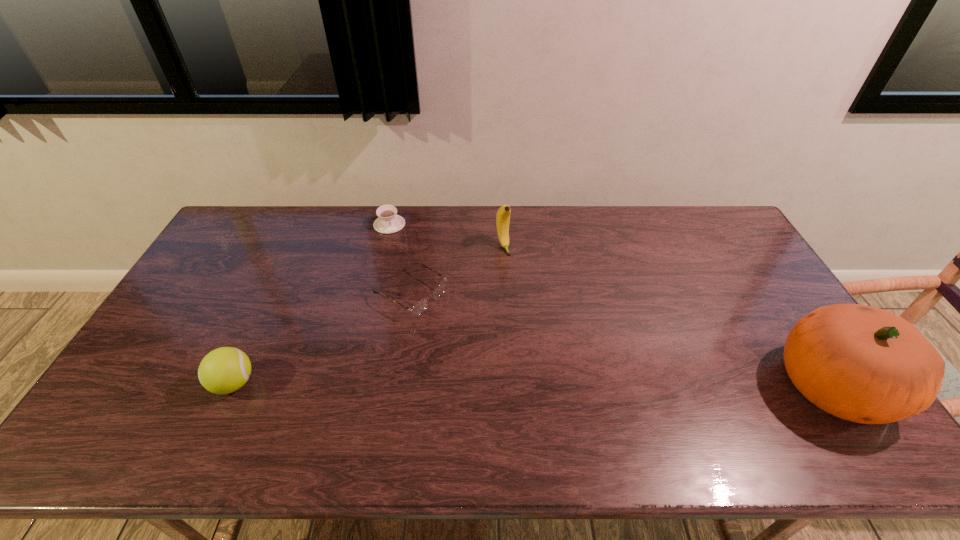
At what (x,y) coordinates should I click in order to perform the action: click on tennis ball present at the near edge. Please return your answer as a coordinate pair (x, y). Image resolution: width=960 pixels, height=540 pixels. Looking at the image, I should click on (224, 370).

This screenshot has height=540, width=960. Identify the location of pumpkin situated at the near edge. (860, 363).

Where is `object positioned at the right edge`? The height and width of the screenshot is (540, 960). object positioned at the right edge is located at coordinates (860, 363).

Find the location of `object present at the near right corner`. object present at the near right corner is located at coordinates (860, 363).

The height and width of the screenshot is (540, 960). Identify the location of vacant space at the far edge of the desktop. (642, 238).

At what (x,y) coordinates should I click in order to perform the action: click on free spot at the near edge of the desktop. Please return your answer as a coordinate pair (x, y). The width and height of the screenshot is (960, 540). Looking at the image, I should click on point(492,403).

Find the location of a particular element. This screenshot has width=960, height=540. blank space at the left edge of the desktop is located at coordinates (251, 256).

You are a GUI agent. You are given a task and a screenshot of the screen. Output one action in this format:
    pyautogui.click(x=<x>, y=<y>)
    Task: Click on the free space at the right edge of the desktop
    
    Given the screenshot: What is the action you would take?
    pyautogui.click(x=751, y=298)

In the image, there is a desktop. Identify the location of free space at the far left corner. The width and height of the screenshot is (960, 540). (225, 231).

This screenshot has width=960, height=540. In the image, there is a desktop. In order to click on free space at the far right corner in this screenshot , I will do (722, 245).